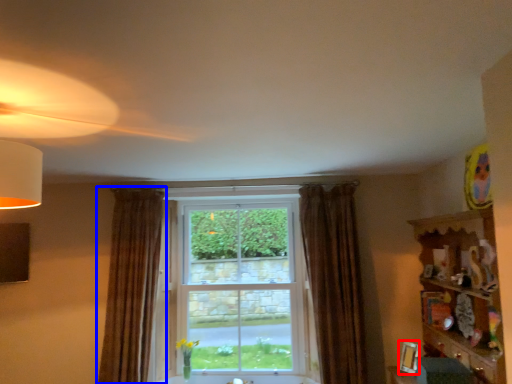
Question: Which object is further to the camera taking this photo, picture frame (highlighted by a red box) or curtain (highlighted by a blue box)?

Choices:
 (A) picture frame
 (B) curtain

Answer: (B)